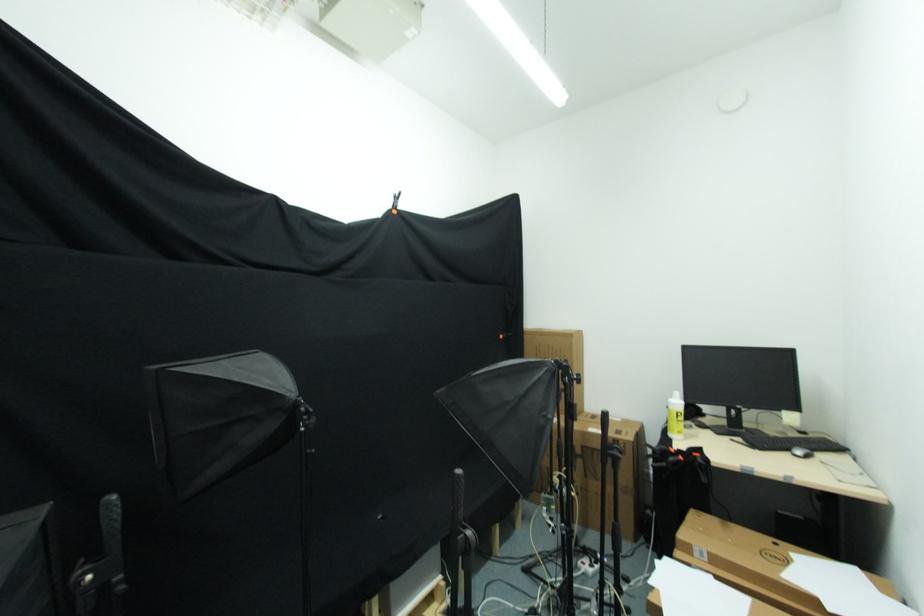
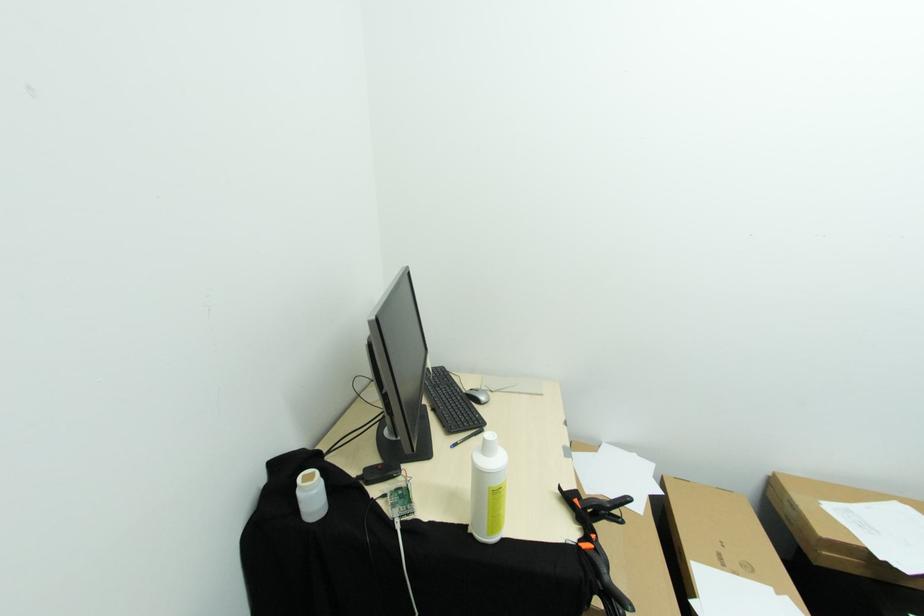
The point at [699,466] is marked in the first image. Where is the corresponding point in the second image?

(604, 515)